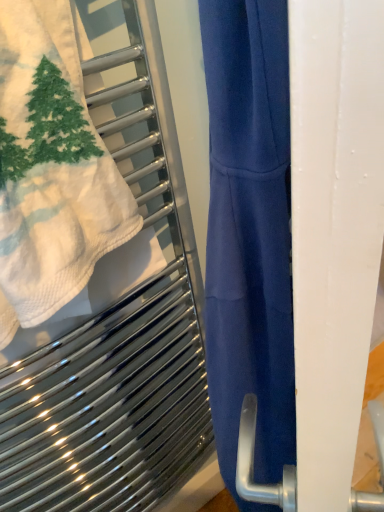
Consider the image. Measure the distance between point (310, 7) and camera.

Point (310, 7) and camera are 6.42 inches apart from each other.

What is the approximate height of white matte screen door at right?

It is 1.33 meters.

This screenshot has height=512, width=384. Describe the element at coordinates (334, 232) in the screenshot. I see `white matte screen door at right` at that location.

Image resolution: width=384 pixels, height=512 pixels. I want to click on white matte screen door at right, so point(334,232).

Describe the element at coordinates (51, 168) in the screenshot. I see `white textured towel at upper left` at that location.

Locate an element on the screen. The image size is (384, 512). white textured towel at upper left is located at coordinates (51, 168).

Where is `white matte screen door at right`? white matte screen door at right is located at coordinates (334, 232).

Can you confirm if white matte screen door at right is positioned to the left of white textured towel at upper left?

Incorrect, white matte screen door at right is not on the left side of white textured towel at upper left.

Which object is closer to the camera taking this photo, white matte screen door at right or white textured towel at upper left?

Positioned in front is white matte screen door at right.

Is point (293, 74) positioned in front of point (21, 271)?

Yes, it is.

From the image's perspective, who appears lower, white matte screen door at right or white textured towel at upper left?

white matte screen door at right appears lower in the image.

From a real-world perspective, is white matte screen door at right positioned above or below white textured towel at upper left?

Clearly, from a real-world perspective, white matte screen door at right is below white textured towel at upper left.

Considering the relative sizes of white matte screen door at right and white textured towel at upper left in the image provided, is white matte screen door at right wider than white textured towel at upper left?

In fact, white matte screen door at right might be narrower than white textured towel at upper left.

Is white matte screen door at right taller than white textured towel at upper left?

Indeed, white matte screen door at right has a greater height compared to white textured towel at upper left.

Considering the sizes of objects white matte screen door at right and white textured towel at upper left in the image provided, who is smaller, white matte screen door at right or white textured towel at upper left?

Smaller between the two is white textured towel at upper left.

Is white matte screen door at right positioned beyond the bounds of white textured towel at upper left?

Indeed, white matte screen door at right is completely outside white textured towel at upper left.

Is white matte screen door at right far from white textured towel at upper left?

white matte screen door at right is actually quite close to white textured towel at upper left.

Is white matte screen door at right facing towards white textured towel at upper left?

Yes, white matte screen door at right is aimed at white textured towel at upper left.

In the image, there is a white matte screen door at right. Where is `towel above it (from the image's perspective)`? This screenshot has height=512, width=384. towel above it (from the image's perspective) is located at coordinates (51, 168).

Is white textured towel at upper left at the right side of white matte screen door at right?

In fact, white textured towel at upper left is to the left of white matte screen door at right.

Is white textured towel at upper left further to the viewer compared to white matte screen door at right?

Yes.

Considering the positions of point (57, 156) and point (352, 187), is point (57, 156) closer or farther from the camera than point (352, 187)?

Point (57, 156).

From the image's perspective, is white textured towel at upper left above white matte screen door at right?

Correct, white textured towel at upper left appears higher than white matte screen door at right in the image.

From a real-world perspective, is white textured towel at upper left located higher than white matte screen door at right?

Yes, from a real-world perspective, white textured towel at upper left is over white matte screen door at right

Does white textured towel at upper left have a greater width compared to white matte screen door at right?

Yes.

Between white textured towel at upper left and white matte screen door at right, which one has more height?

With more height is white matte screen door at right.

Considering the sizes of white textured towel at upper left and white matte screen door at right in the image, is white textured towel at upper left bigger or smaller than white matte screen door at right?

Considering their sizes, white textured towel at upper left takes up less space than white matte screen door at right.

Which is correct: white textured towel at upper left is inside white matte screen door at right, or outside of it?

white textured towel at upper left is spatially situated outside white matte screen door at right.

Would you consider white textured towel at upper left to be distant from white matte screen door at right?

Actually, white textured towel at upper left and white matte screen door at right are a little close together.

Could you tell me if white textured towel at upper left is turned towards white matte screen door at right?

No, white textured towel at upper left is not facing towards white matte screen door at right.

What's the angular difference between white textured towel at upper left and white matte screen door at right's facing directions?

48 degrees.

The width and height of the screenshot is (384, 512). In order to click on screen door below the white textured towel at upper left (from the image's perspective) in this screenshot , I will do `click(334, 232)`.

Image resolution: width=384 pixels, height=512 pixels. Find the location of `screen door below the white textured towel at upper left (from a real-world perspective)`. screen door below the white textured towel at upper left (from a real-world perspective) is located at coordinates (334, 232).

Identify the location of towel above the white matte screen door at right (from the image's perspective). The height and width of the screenshot is (512, 384). (51, 168).